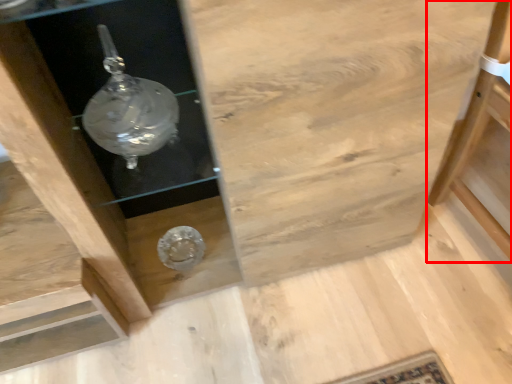
Question: From the image's perspective, where is furniture (annotated by the red box) located in relation to cabinetry in the image?

Choices:
 (A) below
 (B) above

Answer: (A)